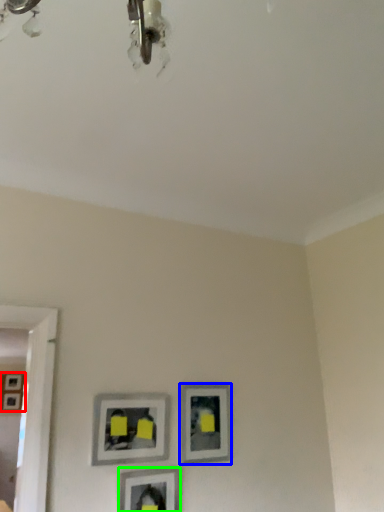
Question: Which object is positioned farthest from picture frame (highlighted by a red box)? Select from picture frame (highlighted by a blue box) and picture frame (highlighted by a green box).

Choices:
 (A) picture frame
 (B) picture frame

Answer: (B)